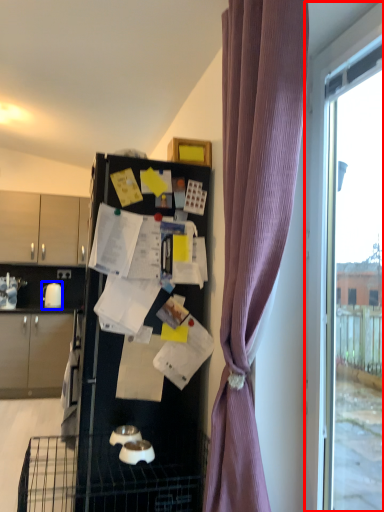
Question: Which of the following is the farthest to the observer, window (highlighted by a red box) or appliance (highlighted by a blue box)?

Choices:
 (A) window
 (B) appliance

Answer: (B)